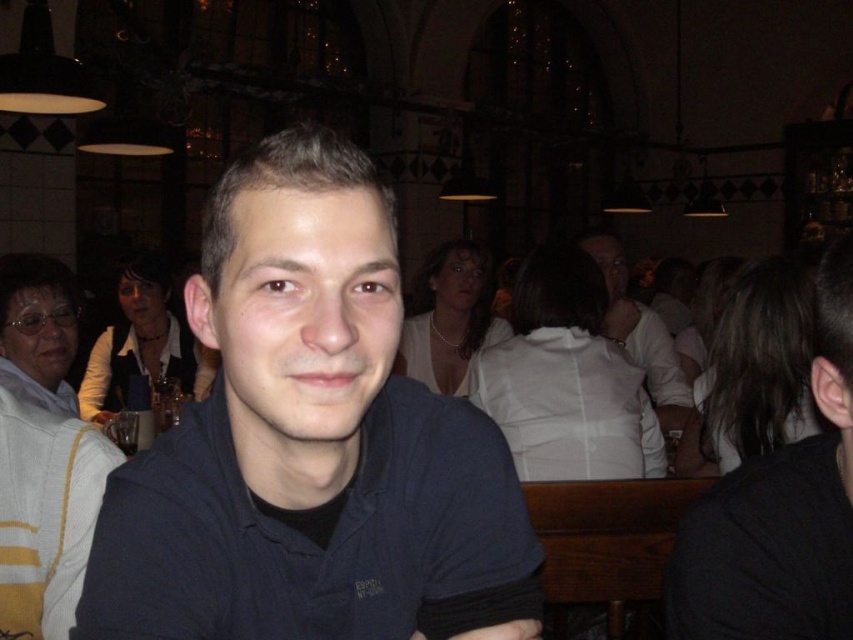
Between dark blue shirt at center and white matte shirt at center, which one is positioned higher?

dark blue shirt at center is above.

Locate an element on the screen. This screenshot has height=640, width=853. dark blue shirt at center is located at coordinates (310, 444).

Which is in front, point (315, 620) or point (671, 380)?

Point (315, 620) is in front.

Locate an element on the screen. dark blue shirt at center is located at coordinates (310, 444).